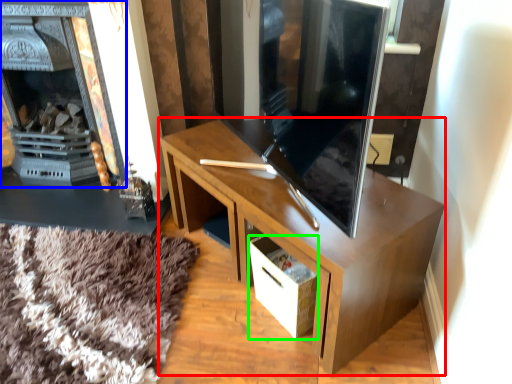
Question: Which object is positioned closest to desk (highlighted by a red box)? Select from fireplace (highlighted by a blue box) and drawer (highlighted by a green box).

Choices:
 (A) fireplace
 (B) drawer

Answer: (B)